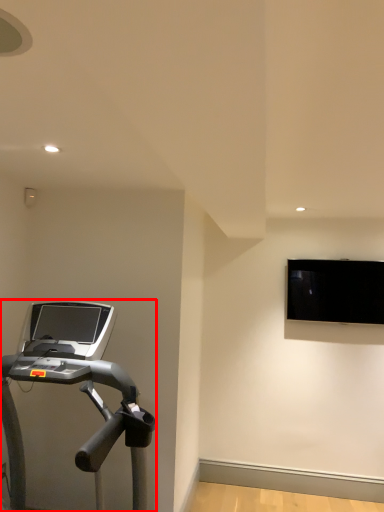
Question: From the image's perspective, where is treadmill (annotated by the red box) located in relation to computer monitor in the image?

Choices:
 (A) below
 (B) above

Answer: (A)